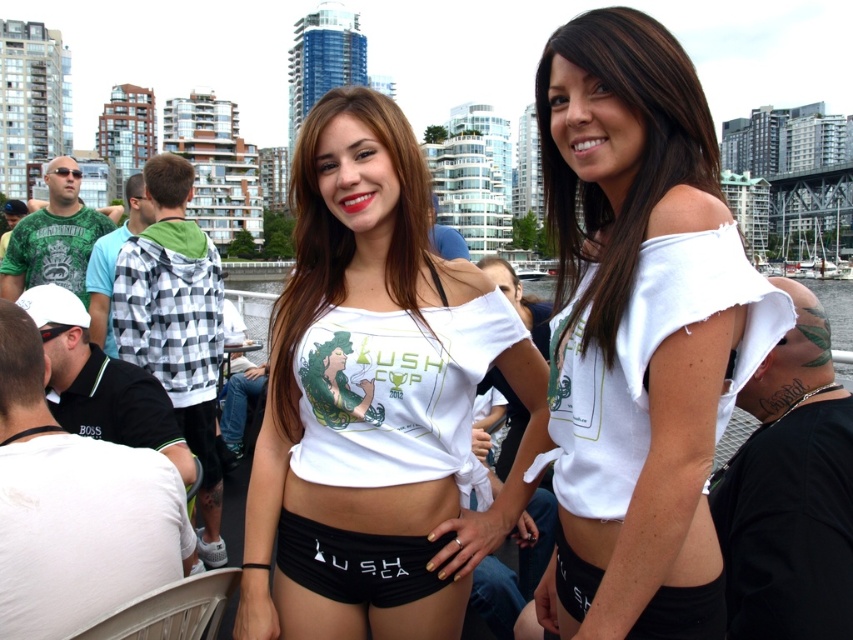
You are at the event and want to find the black matte shorts at center. Which direction should you look relative to the white frayed shirt at center?

The black matte shorts at center is to the left of the white frayed shirt at center.

You are a photographer at the event and want to capture a photo of the two women. Since the white matte bikini top at center and black matte shorts at center are both in focus, can you tell me which one is positioned higher in the image?

The white matte bikini top at center is above the black matte shorts at center, so it is positioned higher in the image.

You are a photographer trying to capture a candid shot of the two central figures wearing the white frayed shirt at center and the black matte shorts at center. Since the camera has a limited focus area, you need to know which clothing item is wider to ensure proper framing. Which one is wider?

The white frayed shirt at center is wider than the black matte shorts at center, so you should frame the shot to accommodate the shirt first.